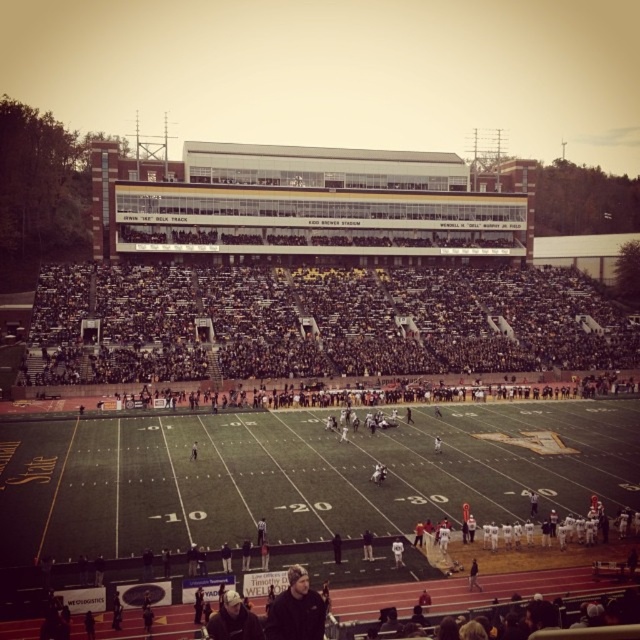
Which is more to the left, black plastic seats at center or white jersey at center?

Positioned to the left is white jersey at center.

Who is higher up, black plastic seats at center or white jersey at center?

black plastic seats at center is higher up.

Where is `black plastic seats at center`? This screenshot has width=640, height=640. black plastic seats at center is located at coordinates (320, 323).

Is black plastic seats at center shorter than light brown leather jacket at center?

No, black plastic seats at center is not shorter than light brown leather jacket at center.

Who is more forward, (536, 364) or (193, 448)?

Positioned in front is point (193, 448).

Which is in front, point (417, 291) or point (189, 458)?

Point (189, 458) is more forward.

Where is `black plastic seats at center`? The image size is (640, 640). black plastic seats at center is located at coordinates (320, 323).

Which is behind, point (227, 636) or point (396, 552)?

Positioned behind is point (396, 552).

Consider the image. Between dark gray knit hat at lower center and white jersey at center, which one appears on the right side from the viewer's perspective?

From the viewer's perspective, white jersey at center appears more on the right side.

Identify the location of dark gray knit hat at lower center. (234, 620).

Identify the location of dark gray knit hat at lower center. Image resolution: width=640 pixels, height=640 pixels. (234, 620).